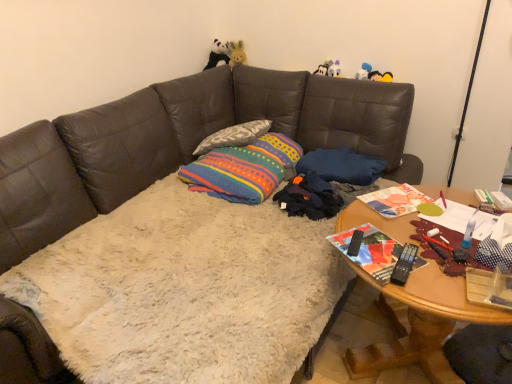
Question: Is multicolored fabric throw pillow at center thinner than textured gray pillow at center, the first pillow viewed from the left?

Choices:
 (A) yes
 (B) no

Answer: (B)

Question: Is multicolored fabric throw pillow at center far from textured gray pillow at center, placed as the 2th pillow when sorted from right to left?

Choices:
 (A) yes
 (B) no

Answer: (B)

Question: Considering the relative sizes of multicolored fabric throw pillow at center and textured gray pillow at center, placed as the 2th pillow when sorted from right to left, in the image provided, is multicolored fabric throw pillow at center taller than textured gray pillow at center, placed as the 2th pillow when sorted from right to left,?

Choices:
 (A) no
 (B) yes

Answer: (B)

Question: From a real-world perspective, is multicolored fabric throw pillow at center located higher than textured gray pillow at center, the first pillow viewed from the left?

Choices:
 (A) yes
 (B) no

Answer: (B)

Question: From a real-world perspective, is multicolored fabric throw pillow at center physically below textured gray pillow at center, placed as the 2th pillow when sorted from right to left?

Choices:
 (A) no
 (B) yes

Answer: (B)

Question: Visually, is blue fabric pillow at center, the first pillow when ordered from right to left, positioned to the left or to the right of black plush panda at upper center?

Choices:
 (A) left
 (B) right

Answer: (B)

Question: In terms of width, does blue fabric pillow at center, the first pillow when ordered from right to left, look wider or thinner when compared to black plush panda at upper center?

Choices:
 (A) thin
 (B) wide

Answer: (B)

Question: Considering the positions of blue fabric pillow at center, the first pillow when ordered from right to left, and black plush panda at upper center in the image, is blue fabric pillow at center, the first pillow when ordered from right to left, bigger or smaller than black plush panda at upper center?

Choices:
 (A) small
 (B) big

Answer: (B)

Question: Is blue fabric pillow at center, marked as the second pillow in a left-to-right arrangement, inside the boundaries of black plush panda at upper center, or outside?

Choices:
 (A) outside
 (B) inside

Answer: (A)

Question: In terms of size, does black plush panda at upper center appear bigger or smaller than textured gray pillow at center, the first pillow viewed from the left?

Choices:
 (A) small
 (B) big

Answer: (A)

Question: Considering the positions of point (224, 51) and point (249, 132), is point (224, 51) closer or farther from the camera than point (249, 132)?

Choices:
 (A) closer
 (B) farther

Answer: (B)

Question: Is black plush panda at upper center wider or thinner than textured gray pillow at center, the first pillow viewed from the left?

Choices:
 (A) thin
 (B) wide

Answer: (A)

Question: Based on their positions, is black plush panda at upper center located to the left or right of textured gray pillow at center, placed as the 2th pillow when sorted from right to left?

Choices:
 (A) right
 (B) left

Answer: (B)

Question: In terms of size, does multicolored fabric throw pillow at center appear bigger or smaller than white fluffy couch at center?

Choices:
 (A) big
 (B) small

Answer: (B)

Question: In terms of width, does multicolored fabric throw pillow at center look wider or thinner when compared to white fluffy couch at center?

Choices:
 (A) wide
 (B) thin

Answer: (B)